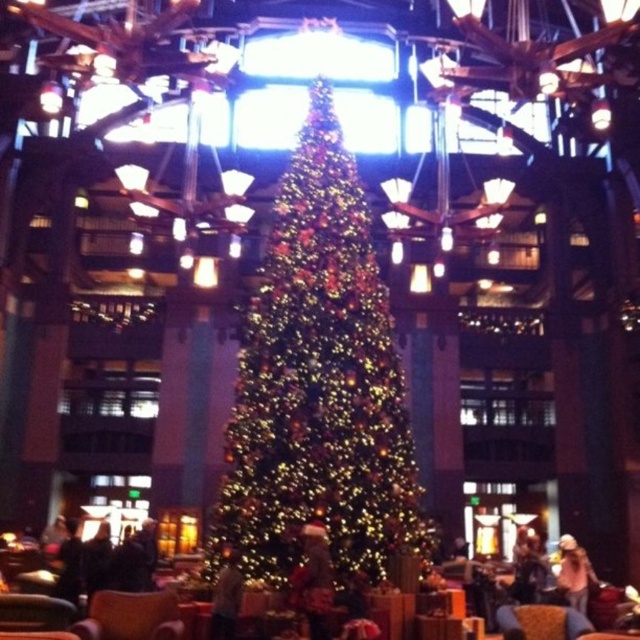
You are standing in the lobby and want to sit down in the brown leather armchair at lower center. To do so, you need to step around the fuzzy brown coat at center. Which direction should you move relative to the coat?

To reach the brown leather armchair at lower center, you should move to the left of the fuzzy brown coat at center, as the armchair is positioned to the left of the coat.

You are a photographer setting up a tripod in the lobby and need to position it so that both the light brown leather jacket at lower center and the denim jacket at lower right are visible in the frame. Given their height difference, which jacket might block the view of the other if placed directly in front?

The light brown leather jacket at lower center is much taller than the denim jacket at lower right, so placing it directly in front could block the view of the denim jacket at lower right.

You are standing in the festive lobby and want to know how far the point at coordinates (324,86) is from your current position. Can you determine the distance?

The distance between the point at coordinates (324,86) and the viewer is 71.04 meters.